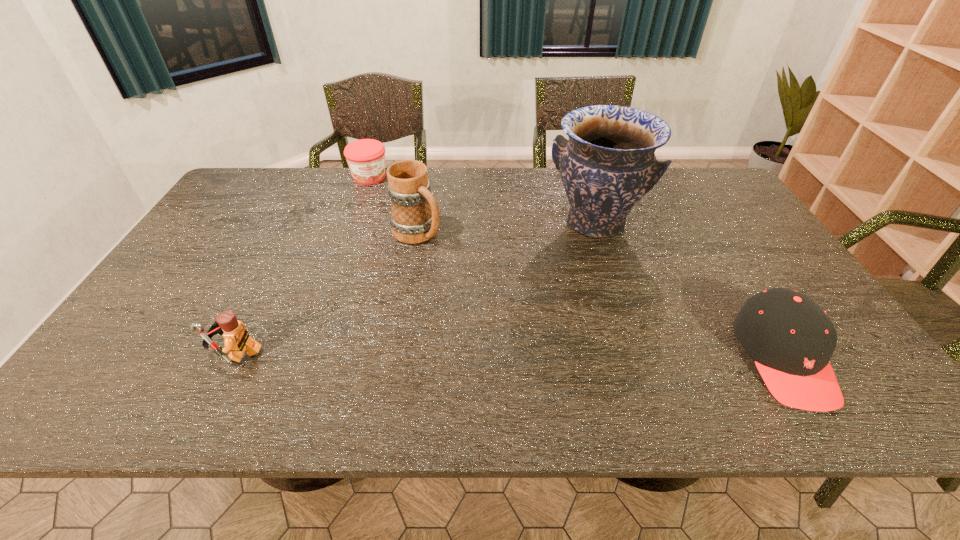
Where is `jam that is at the far edge`? jam that is at the far edge is located at coordinates (366, 157).

In order to click on pottery that is at the far edge in this screenshot , I will do `click(608, 164)`.

Where is `Lego positioned at the near edge`? This screenshot has height=540, width=960. Lego positioned at the near edge is located at coordinates (237, 340).

Where is `cap at the near edge`? cap at the near edge is located at coordinates (791, 339).

Where is `object that is at the right edge`? object that is at the right edge is located at coordinates (791, 339).

Locate an element on the screen. object that is at the near right corner is located at coordinates (791, 339).

At what (x,y) coordinates should I click in order to perform the action: click on blank space at the far edge of the desktop. Please return your answer as a coordinate pair (x, y). Looking at the image, I should click on (558, 186).

In the image, there is a desktop. Where is `vacant space at the near edge`? The image size is (960, 540). vacant space at the near edge is located at coordinates (570, 340).

Locate an element on the screen. blank space at the left edge of the desktop is located at coordinates (218, 255).

Locate an element on the screen. Image resolution: width=960 pixels, height=540 pixels. free region at the right edge of the desktop is located at coordinates (742, 234).